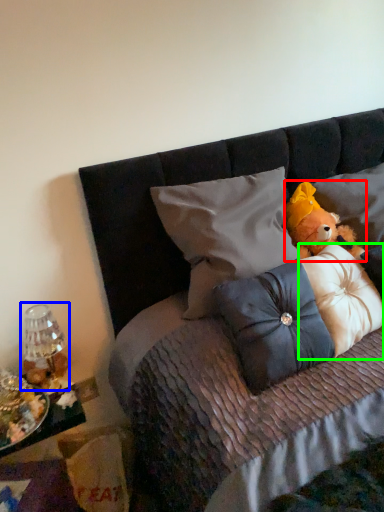
Question: Considering the real-world distances, which object is farthest from teddy bear (highlighted by a red box)? lamp (highlighted by a blue box) or pillow (highlighted by a green box)?

Choices:
 (A) lamp
 (B) pillow

Answer: (A)